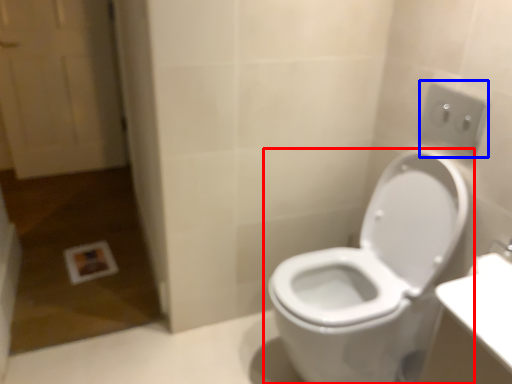
Question: Which object is further to the camera taking this photo, toilet (highlighted by a red box) or electric outlet (highlighted by a blue box)?

Choices:
 (A) toilet
 (B) electric outlet

Answer: (B)